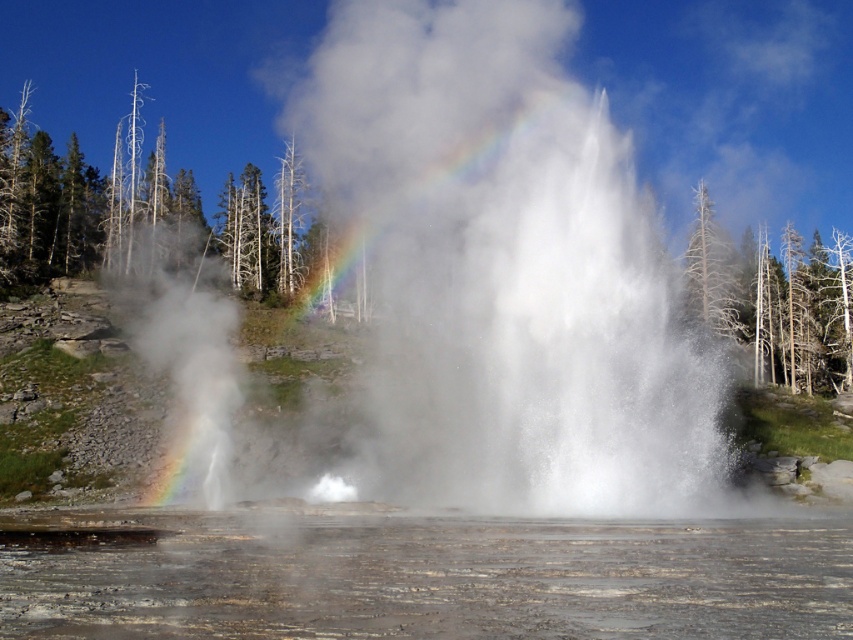
Question: Among these points, which one is farthest from the camera?

Choices:
 (A) (310, 577)
 (B) (540, 52)

Answer: (B)

Question: From the image, what is the correct spatial relationship of white vapor at center in relation to translucent gray water at lower center?

Choices:
 (A) above
 (B) below

Answer: (A)

Question: Can you confirm if white vapor at center is thinner than translucent gray water at lower center?

Choices:
 (A) no
 (B) yes

Answer: (A)

Question: From the image, what is the correct spatial relationship of white vapor at center in relation to translucent gray water at lower center?

Choices:
 (A) left
 (B) right

Answer: (B)

Question: Which point is farther to the camera?

Choices:
 (A) (637, 436)
 (B) (496, 524)

Answer: (A)

Question: Which point appears farthest from the camera in this image?

Choices:
 (A) (114, 548)
 (B) (587, 483)

Answer: (B)